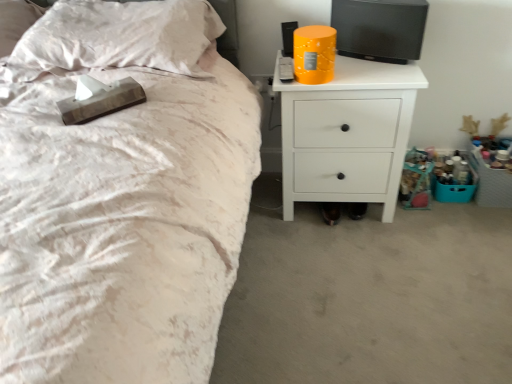
Question: Does white matte nightstand at upper right appear on the right side of white satin pillow at upper left?

Choices:
 (A) yes
 (B) no

Answer: (A)

Question: Would you consider white matte nightstand at upper right to be distant from white satin pillow at upper left?

Choices:
 (A) yes
 (B) no

Answer: (B)

Question: From the image's perspective, does white matte nightstand at upper right appear higher than white satin pillow at upper left?

Choices:
 (A) yes
 (B) no

Answer: (B)

Question: Is white matte nightstand at upper right looking in the opposite direction of white satin pillow at upper left?

Choices:
 (A) yes
 (B) no

Answer: (B)

Question: From a real-world perspective, is white matte nightstand at upper right below white satin pillow at upper left?

Choices:
 (A) yes
 (B) no

Answer: (A)

Question: Does white matte nightstand at upper right have a greater width compared to white satin pillow at upper left?

Choices:
 (A) yes
 (B) no

Answer: (B)

Question: Is white satin pillow at upper left to the left of white matte nightstand at upper right from the viewer's perspective?

Choices:
 (A) no
 (B) yes

Answer: (B)

Question: Is white satin pillow at upper left next to white matte nightstand at upper right and touching it?

Choices:
 (A) no
 (B) yes

Answer: (A)

Question: From a real-world perspective, is white satin pillow at upper left over white matte nightstand at upper right?

Choices:
 (A) no
 (B) yes

Answer: (B)

Question: Considering the relative sizes of white satin pillow at upper left and white matte nightstand at upper right in the image provided, is white satin pillow at upper left thinner than white matte nightstand at upper right?

Choices:
 (A) yes
 (B) no

Answer: (B)

Question: Does white satin pillow at upper left have a greater width compared to white matte nightstand at upper right?

Choices:
 (A) yes
 (B) no

Answer: (A)

Question: Considering the relative positions of white satin pillow at upper left and white matte nightstand at upper right in the image provided, is white satin pillow at upper left to the right of white matte nightstand at upper right from the viewer's perspective?

Choices:
 (A) yes
 (B) no

Answer: (B)

Question: From the image's perspective, is white satin pillow at upper left positioned above or below white matte nightstand at upper right?

Choices:
 (A) below
 (B) above

Answer: (B)